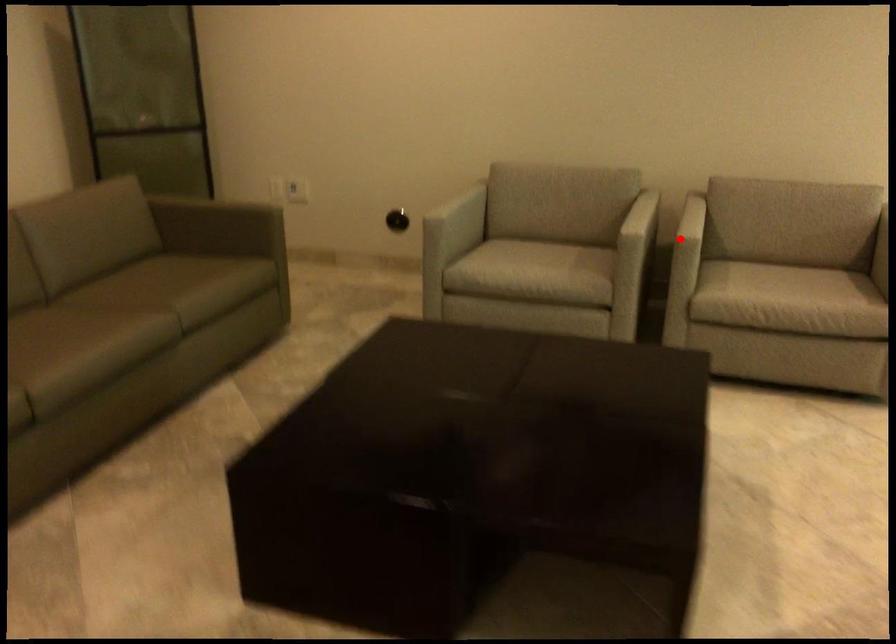
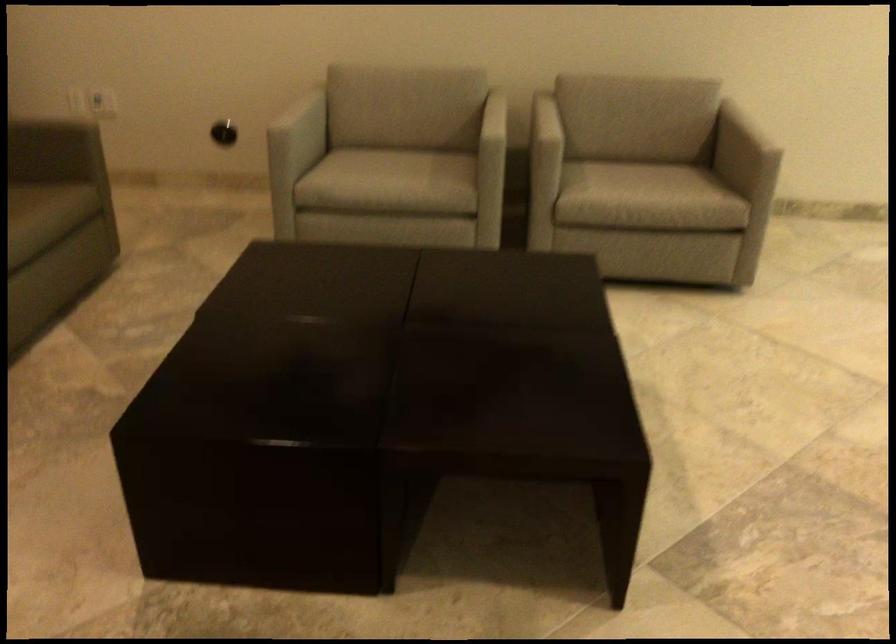
In the second image, find the point that corresponds to the highlighted location in the first image.

(545, 140)